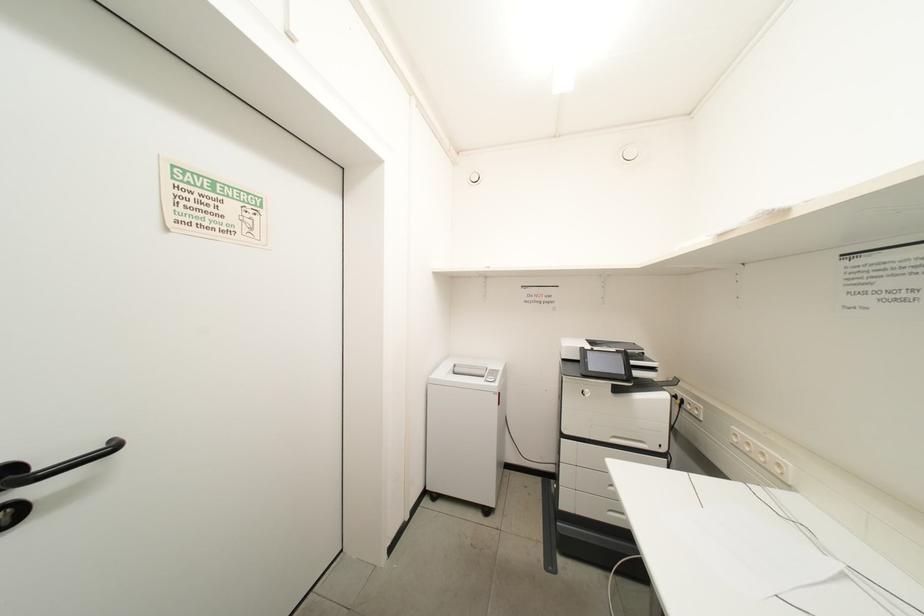
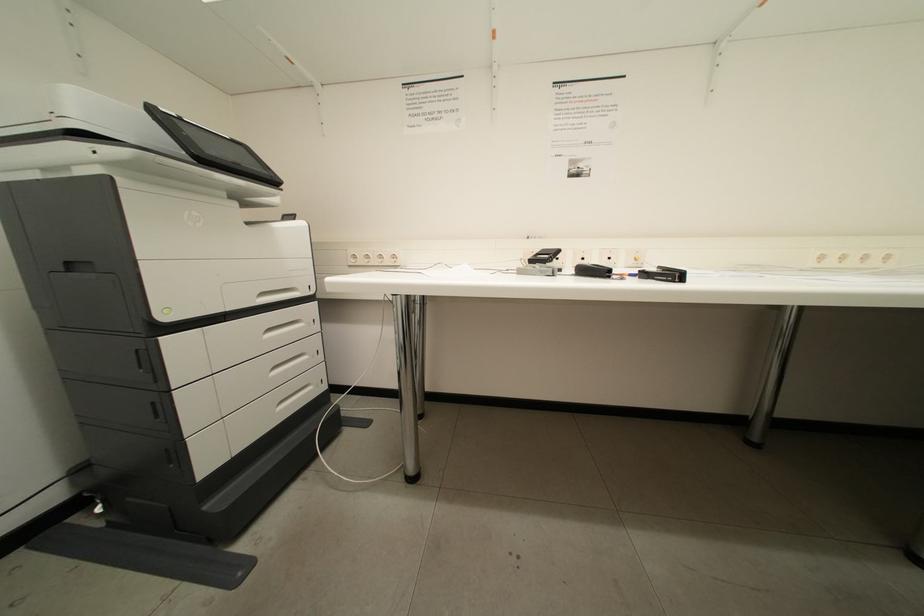
Question: The camera is either moving clockwise (left) or counter-clockwise (right) around the object. The first image is from the beginning of the video and the second image is from the end. Is the camera moving left or right when shooting the video?

Choices:
 (A) Left
 (B) Right

Answer: (A)